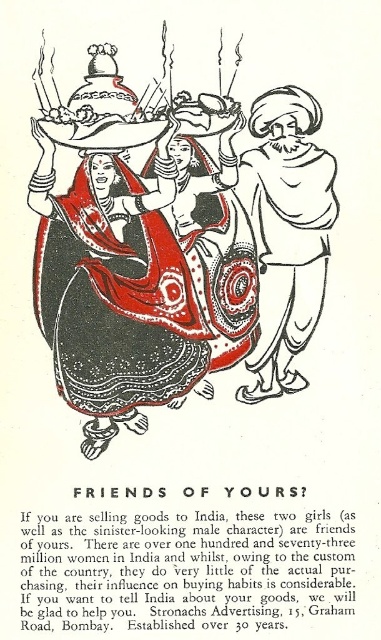
You are designing a display for a cultural exhibition and need to place a label next to the larger object between the matte black dress at center and the white paper turban at center. Which object should the label be placed next to?

The label should be placed next to the matte black dress at center because it is larger in size than the white paper turban at center.